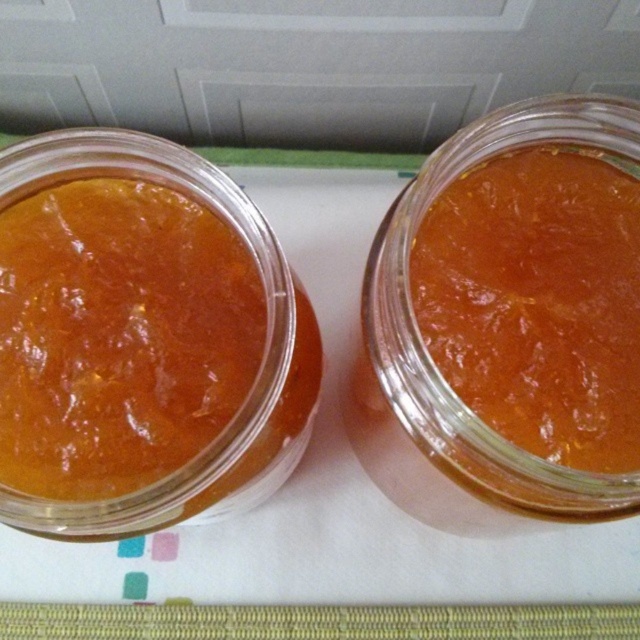
You are a chef preparing to store ingredients. You have two containers in front of you, the matte orange jam at left and the translucent glass jar at center. Which container has a lower height?

The matte orange jam at left is shorter than the translucent glass jar at center, so the matte orange jam at left has a lower height.

You are a chef trying to arrange these items on a shelf. The shelf has a height limit of 15 centimeters. Can you place the matte orange jam at left and the translucent glass jar at center next to each other without exceeding the shelf height?

The distance between the matte orange jam at left and the translucent glass jar at center is 14.59 centimeters, which is under the 15 centimeter height limit. Therefore, they can be placed next to each other on the shelf without exceeding the height restriction.